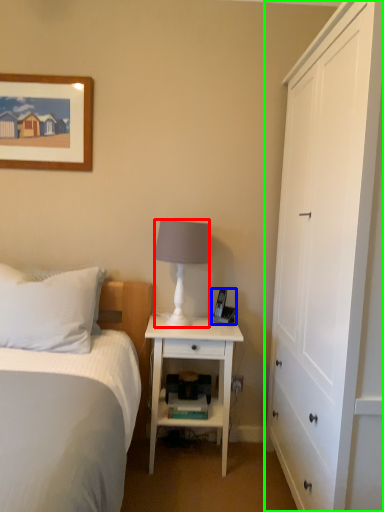
Question: Based on their relative distances, which object is nearer to lamp (highlighted by a red box)? Choose from corded phone (highlighted by a blue box) and cabinetry (highlighted by a green box).

Choices:
 (A) corded phone
 (B) cabinetry

Answer: (A)